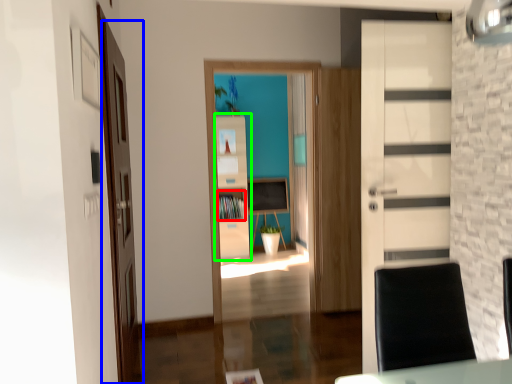
Question: Which is farther away from cabinet (highlighted by a red box)? door (highlighted by a blue box) or cabinetry (highlighted by a green box)?

Choices:
 (A) door
 (B) cabinetry

Answer: (A)